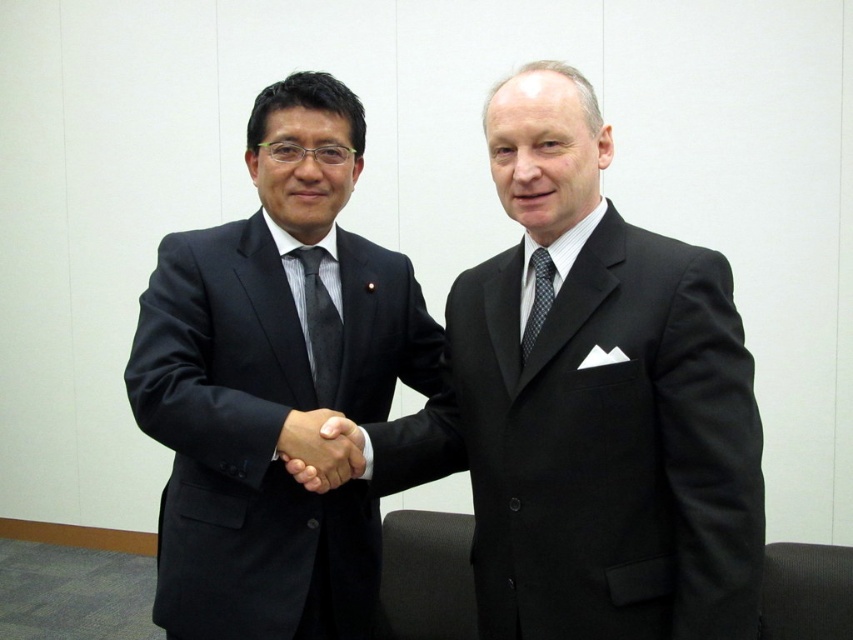
Which is behind, point (663, 358) or point (316, 486)?

The point (316, 486) is behind.

Can you confirm if black matte suit at center is wider than black smooth hand at center?

Indeed, black matte suit at center has a greater width compared to black smooth hand at center.

Is point (656, 621) behind point (309, 412)?

No, it is in front of (309, 412).

Locate an element on the screen. The width and height of the screenshot is (853, 640). black matte suit at center is located at coordinates (592, 404).

Who is positioned more to the left, black smooth hand at center or dark gray striped tie at center?

dark gray striped tie at center

Can you confirm if black smooth hand at center is positioned to the left of dark gray striped tie at center?

No, black smooth hand at center is not to the left of dark gray striped tie at center.

Is point (335, 474) behind point (325, 355)?

No, it is in front of (325, 355).

Locate an element on the screen. Image resolution: width=853 pixels, height=640 pixels. black smooth hand at center is located at coordinates (x=320, y=449).

Is point (316, 385) positioned behind point (532, 332)?

Yes, it is.

Who is more distant from viewer, (311, 252) or (549, 282)?

The point (311, 252) is more distant.

Identify the location of dark gray striped tie at center. This screenshot has height=640, width=853. (320, 326).